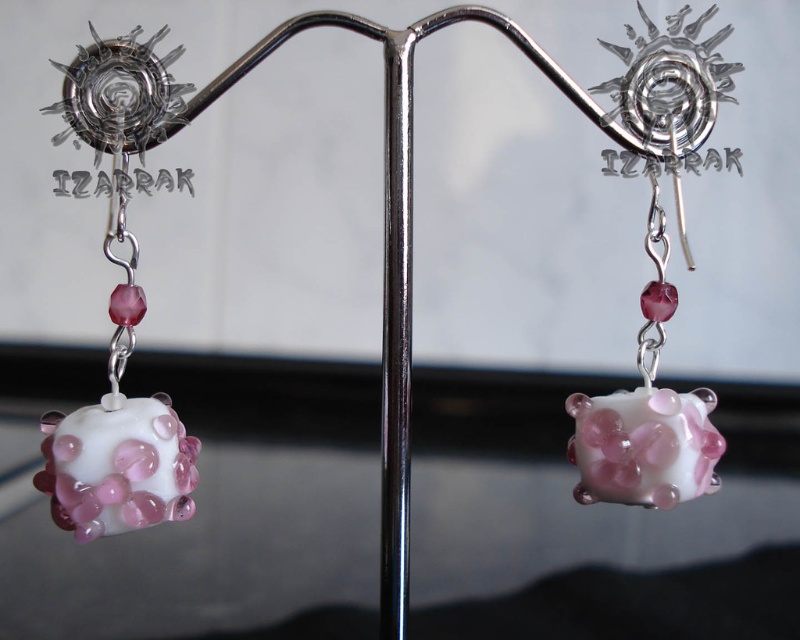
Which of these two, white glossy bead at center or polished metal pole at center, stands taller?

polished metal pole at center is taller.

The image size is (800, 640). I want to click on white glossy bead at center, so click(118, 310).

Locate an element on the screen. white glossy bead at center is located at coordinates (118, 310).

Between translucent pink glass cube at center and polished metal pole at center, which one appears on the left side from the viewer's perspective?

polished metal pole at center is more to the left.

Does point (680, 138) come in front of point (409, 176)?

No, it is not.

At what (x,y) coordinates should I click in order to perform the action: click on translucent pink glass cube at center. Please return your answer as a coordinate pair (x, y). Looking at the image, I should click on (654, 317).

You are a GUI agent. You are given a task and a screenshot of the screen. Output one action in this format:
    pyautogui.click(x=<x>, y=<y>)
    Task: Click on the translucent pink glass cube at center
    This screenshot has width=800, height=640.
    Given the screenshot: What is the action you would take?
    pyautogui.click(x=654, y=317)

Is white glossy bead at center thinner than translucent pink glass cube at center?

Correct, white glossy bead at center's width is less than translucent pink glass cube at center's.

Who is more forward, [113,173] or [668,307]?

Point [113,173] is in front.

Where is `white glossy bead at center`? The height and width of the screenshot is (640, 800). white glossy bead at center is located at coordinates (118, 310).